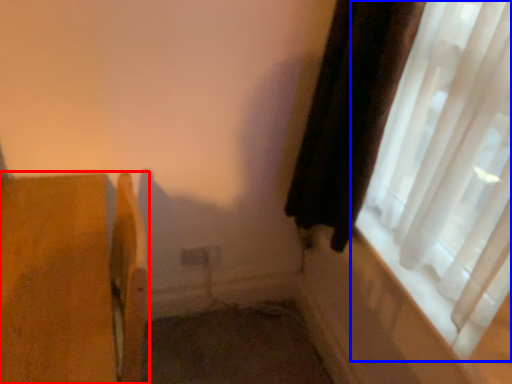
Question: Which object appears closest to the camera in this image, furniture (highlighted by a red box) or window (highlighted by a blue box)?

Choices:
 (A) furniture
 (B) window

Answer: (B)